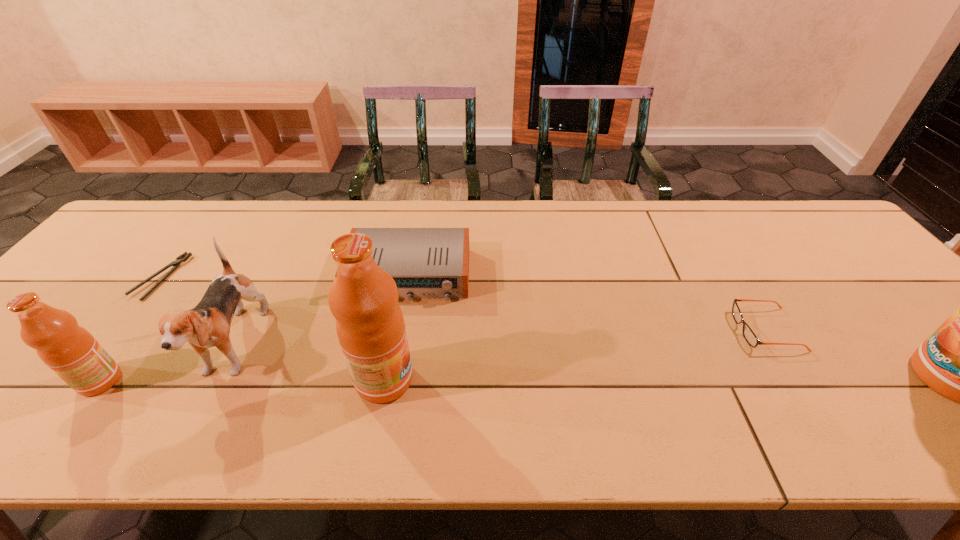
This screenshot has width=960, height=540. Find the location of `vacant space situated 0.100m on the label side of the leftmost fruit juice`. vacant space situated 0.100m on the label side of the leftmost fruit juice is located at coordinates (35, 381).

Locate an element on the screen. free location located 0.120m on the label side of the second tallest fruit juice is located at coordinates (468, 380).

The width and height of the screenshot is (960, 540). In order to click on free point located on the back of the shortest object in this screenshot , I will do `click(220, 200)`.

Image resolution: width=960 pixels, height=540 pixels. I want to click on free space located 0.050m on the front-facing side of the spectacles, so click(x=716, y=330).

Locate an element on the screen. Image resolution: width=960 pixels, height=540 pixels. vacant region located on the front-facing side of the spectacles is located at coordinates (625, 330).

Locate an element on the screen. free space located on the front-facing side of the spectacles is located at coordinates (587, 330).

Where is `free space located 0.260m on the front panel of the radio receiver`? This screenshot has height=540, width=960. free space located 0.260m on the front panel of the radio receiver is located at coordinates click(x=389, y=393).

You are a GUI agent. You are given a task and a screenshot of the screen. Output one action in this format:
    pyautogui.click(x=<x>, y=<y>)
    Task: Click on the puppy at the near edge
    
    Given the screenshot: What is the action you would take?
    pyautogui.click(x=207, y=325)

I want to click on free space at the far edge of the desktop, so click(607, 232).

The width and height of the screenshot is (960, 540). In order to click on free location at the near edge in this screenshot , I will do click(x=321, y=384).